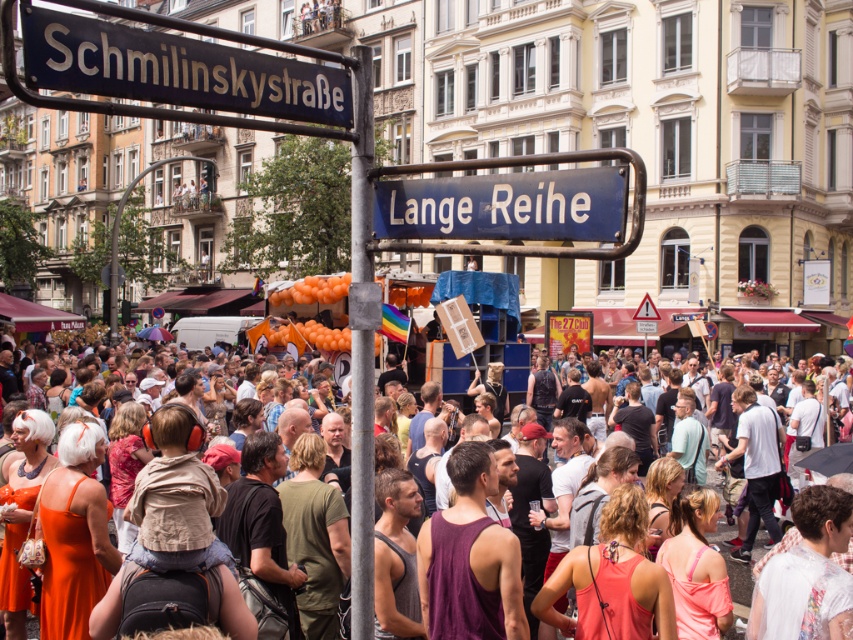
Question: Which of the following is the farthest from the observer?

Choices:
 (A) blue metallic street sign at upper center
 (B) blue metallic street sign at upper left
 (C) multicolored fabric crowd at center
 (D) metallic pole at center

Answer: (C)

Question: Does blue metallic street sign at upper center have a greater width compared to multicolored fabric crowd at center?

Choices:
 (A) no
 (B) yes

Answer: (A)

Question: Among these objects, which one is nearest to the camera?

Choices:
 (A) metallic pole at center
 (B) blue metallic street sign at upper center
 (C) multicolored fabric crowd at center

Answer: (B)

Question: Does blue metallic street sign at upper left have a greater width compared to metallic pole at center?

Choices:
 (A) no
 (B) yes

Answer: (A)

Question: Which point appears closest to the camera in this image?

Choices:
 (A) (367, 470)
 (B) (598, 177)

Answer: (B)

Question: Does blue metallic street sign at upper left have a smaller size compared to blue metallic street sign at upper center?

Choices:
 (A) yes
 (B) no

Answer: (A)